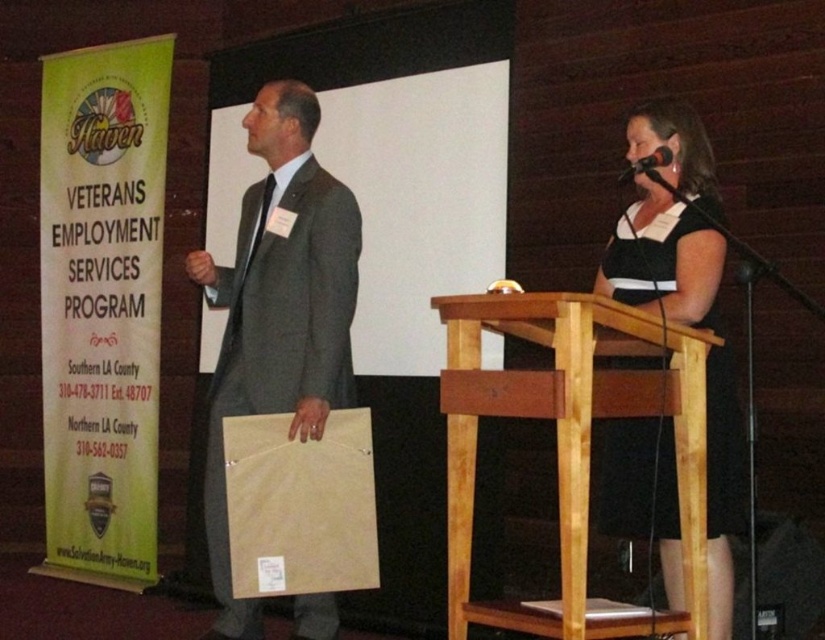
Is point (609, 371) in front of point (660, 145)?

Yes, point (609, 371) is in front of point (660, 145).

Which of these two, light brown wood podium at center or black plastic microphone at upper right, stands taller?

Standing taller between the two is light brown wood podium at center.

Who is more distant from viewer, (633,400) or (629,172)?

Positioned behind is point (629,172).

Where is `light brown wood podium at center`? light brown wood podium at center is located at coordinates (571, 438).

Who is shorter, matte gray suit at center or black satin dress at center?

black satin dress at center is shorter.

Is point (244, 624) in front of point (633, 208)?

No, it is not.

Locate an element on the screen. matte gray suit at center is located at coordinates (277, 310).

Does light brown wood podium at center come behind matte gray suit at center?

No, light brown wood podium at center is in front of matte gray suit at center.

Consider the image. Who is more forward, (451,337) or (333,595)?

Point (451,337) is in front.

The height and width of the screenshot is (640, 825). Identify the location of light brown wood podium at center. (571, 438).